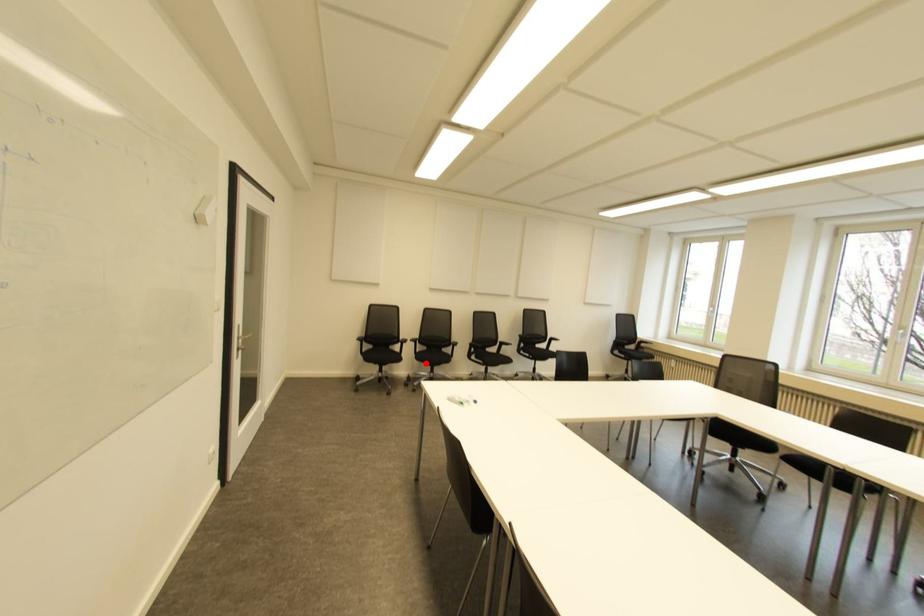
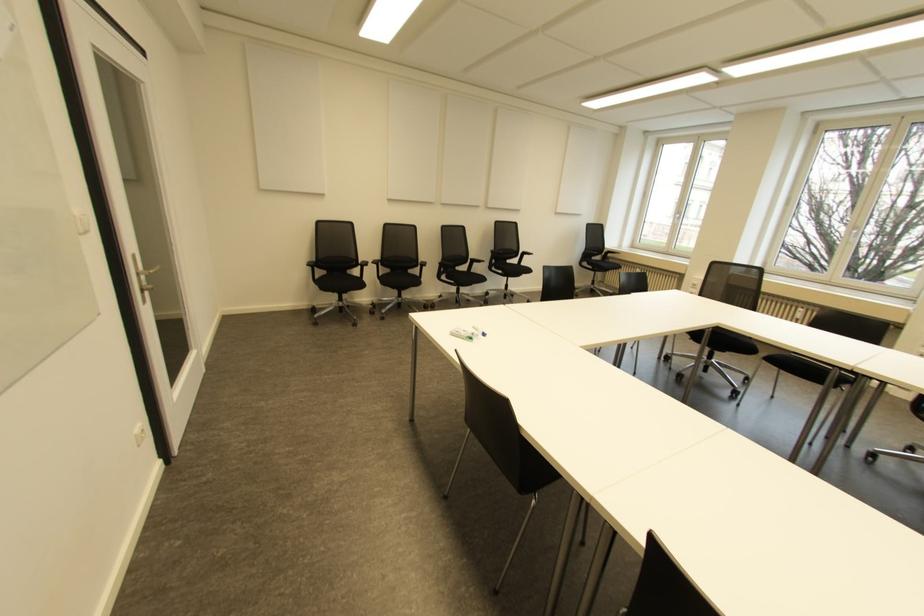
Question: I am providing you with two images of the same scene from different viewpoints. In image1, a red point is highlighted. Considering the same 3D point in image2, which of the following is correct?

Choices:
 (A) It is closer
 (B) It is farther

Answer: (A)